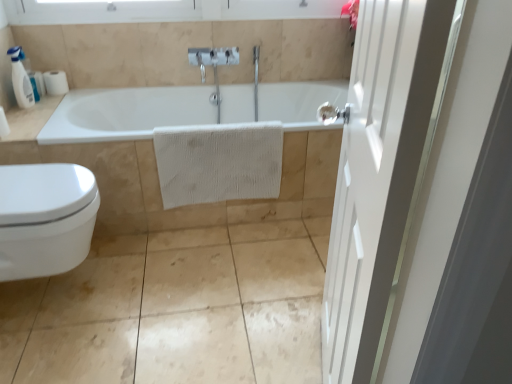
Question: Is point (55, 77) closer or farther from the camera than point (23, 129)?

Choices:
 (A) farther
 (B) closer

Answer: (A)

Question: In the image, is white matte toilet paper at upper left positioned in front of or behind white glossy counter top at upper left?

Choices:
 (A) front
 (B) behind

Answer: (B)

Question: Based on their relative distances, which object is nearer to the white matte toilet paper at upper left?

Choices:
 (A) white glossy bidet at lower left
 (B) white glossy counter top at upper left
 (C) white plastic soap dispenser at upper left
 (D) white textured towel at center
 (E) white wooden door at right

Answer: (C)

Question: Which is farther from the white matte toilet paper at upper left?

Choices:
 (A) white matte towel at center
 (B) white glossy bidet at lower left
 (C) white plastic soap dispenser at upper left
 (D) white wooden door at right
 (E) white glossy counter top at upper left

Answer: (D)